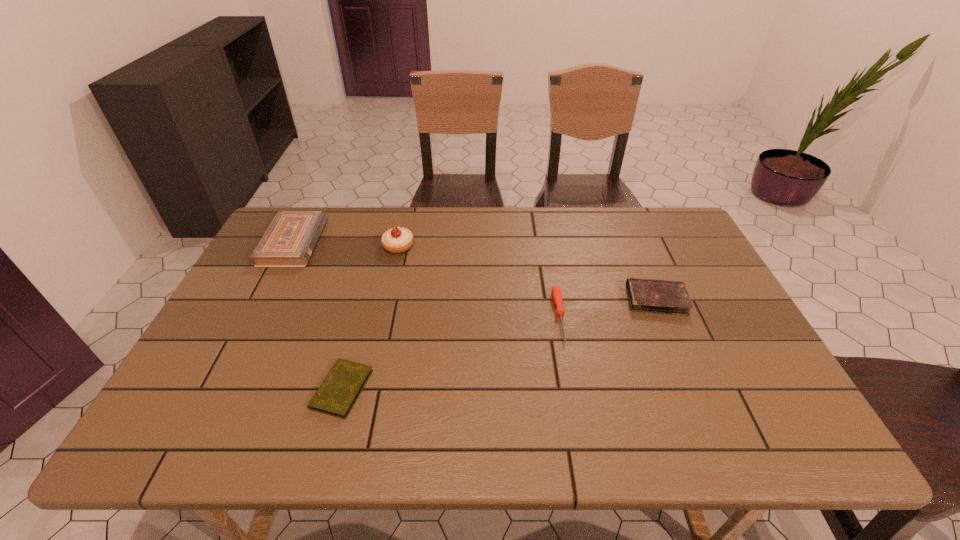
At what (x,y) coordinates should I click in order to perform the action: click on blank space at the far edge of the desktop. Please return your answer as a coordinate pair (x, y). Looking at the image, I should click on tap(544, 216).

Locate an element on the screen. This screenshot has height=540, width=960. blank area at the near edge is located at coordinates (632, 448).

I want to click on free space at the left edge of the desktop, so click(x=231, y=381).

Identify the location of free space at the far left corner of the desktop. (307, 208).

The width and height of the screenshot is (960, 540). Identify the location of free space at the near left corner. (177, 426).

Where is `blank region between the pastry and the fourth shortest object`? This screenshot has width=960, height=540. blank region between the pastry and the fourth shortest object is located at coordinates (347, 244).

Locate an element on the screen. unoccupied position between the screwdriver and the tallest object is located at coordinates (479, 281).

At what (x,y) coordinates should I click in order to perform the action: click on vacant point located between the third shortest object and the leftmost object. Please return your answer as a coordinate pair (x, y). Looking at the image, I should click on (475, 271).

This screenshot has width=960, height=540. Find the location of `free space between the fourth object from left to right and the taller diary`. free space between the fourth object from left to right and the taller diary is located at coordinates (608, 308).

At what (x,y) coordinates should I click in order to perform the action: click on free space between the nearer diary and the fourth tallest object. Please return your answer as a coordinate pair (x, y). Looking at the image, I should click on (451, 353).